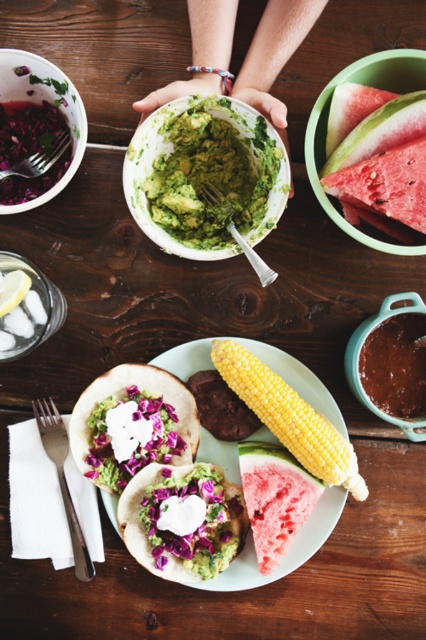
Is green matte guacamole taco at center positioned in front of white creamy tortillas at center?

Yes, green matte guacamole taco at center is in front of white creamy tortillas at center.

You are a GUI agent. You are given a task and a screenshot of the screen. Output one action in this format:
    pyautogui.click(x=<x>, y=<y>)
    Task: Click on the green matte guacamole taco at center
    The image size is (426, 640).
    Given the screenshot: What is the action you would take?
    pyautogui.click(x=183, y=518)

Locate an element on the screen. This screenshot has width=426, height=640. green matte guacamole taco at center is located at coordinates (183, 518).

Does green creamy guacamole at center have a greater height compared to pink juicy watermelon at upper right?

Yes.

From the picture: Can you confirm if green creamy guacamole at center is smaller than pink juicy watermelon at upper right?

No.

This screenshot has width=426, height=640. Identify the location of green creamy guacamole at center. (210, 172).

Locate an element on the screen. This screenshot has width=426, height=640. green creamy guacamole at center is located at coordinates (210, 172).

Is white creamy tortillas at center positioned in front of matte white bowl at upper left?

No, white creamy tortillas at center is behind matte white bowl at upper left.

Can you confirm if white creamy tortillas at center is positioned to the right of matte white bowl at upper left?

Indeed, white creamy tortillas at center is positioned on the right side of matte white bowl at upper left.

Which is behind, point (232, 468) or point (63, 186)?

Positioned behind is point (232, 468).

This screenshot has width=426, height=640. I want to click on white creamy tortillas at center, so click(x=287, y=550).